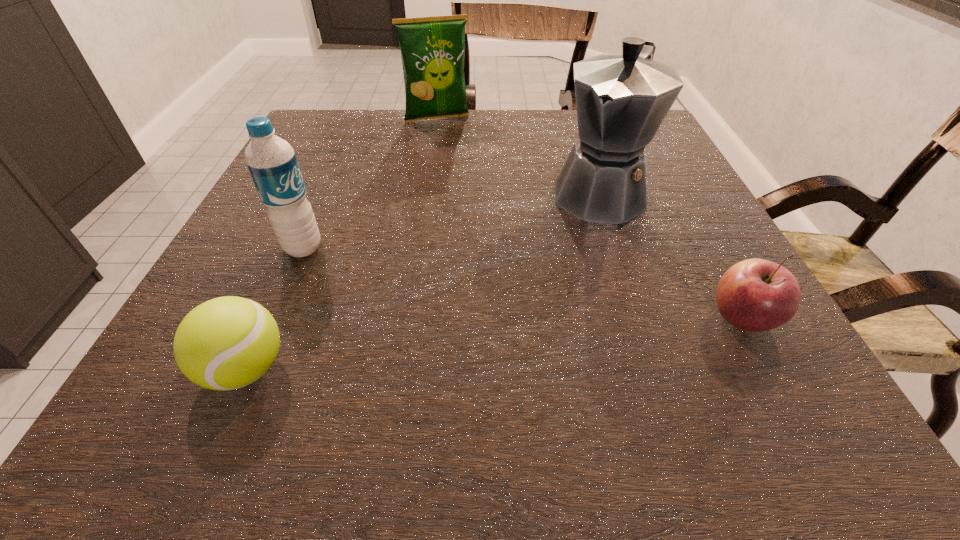
Locate an element on the screen. The width and height of the screenshot is (960, 540). object that is the second closest one to the farthest object is located at coordinates (271, 161).

Find the location of `object that is the closest to the rightmost object`. object that is the closest to the rightmost object is located at coordinates (621, 100).

You are a GUI agent. You are given a task and a screenshot of the screen. Output one action in this format:
    pyautogui.click(x=<x>, y=<y>)
    Task: Click on the free space that satisfies the following two spatial constraints: 1. on the front side of the third object from left to right; 2. on the left side of the fourth object from left to right
    The height and width of the screenshot is (540, 960).
    Given the screenshot: What is the action you would take?
    pyautogui.click(x=426, y=191)

Where is `free point that satisfies the following two spatial constraints: 1. on the back side of the tennis ball; 2. on the right side of the tallest object`? This screenshot has height=540, width=960. free point that satisfies the following two spatial constraints: 1. on the back side of the tennis ball; 2. on the right side of the tallest object is located at coordinates (324, 191).

I want to click on vacant space that satisfies the following two spatial constraints: 1. on the back side of the third farthest object; 2. on the left side of the tennis ball, so [300, 248].